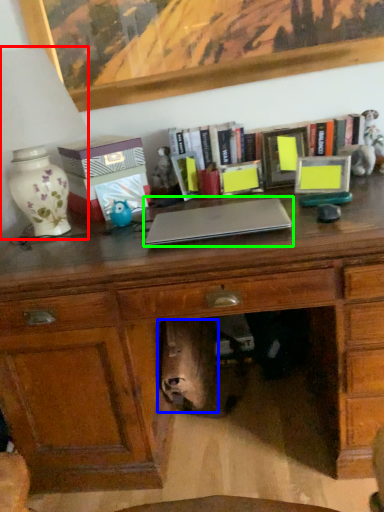
Question: Estimate the real-world distances between objects in this image. Which object is farther from table lamp (highlighted by a red box), animal (highlighted by a blue box) or laptop (highlighted by a green box)?

Choices:
 (A) animal
 (B) laptop

Answer: (A)